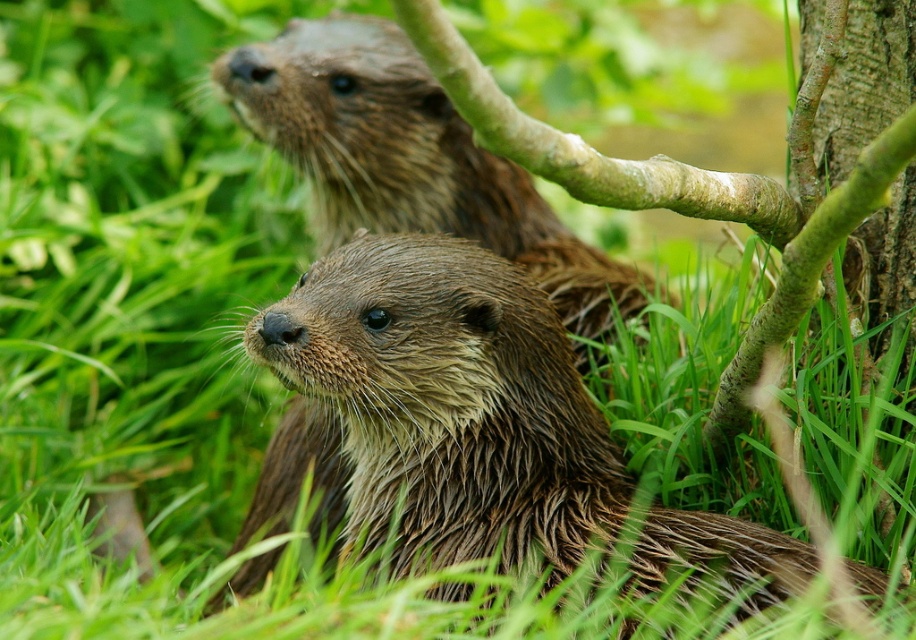
You are observing two otters in a green environment. The first otter is the wet fur otter at center, and the second is the brown wet fur otter at upper center. Which otter is positioned more to the left?

The brown wet fur otter at upper center is positioned more to the left because the wet fur otter at center is to the right of it.

You are observing two otters in a green environment. The wet fur otter at center is in front of the other otter. Which otter is closer to you?

The wet fur otter at center is closer to you because it is in front of the other otter.